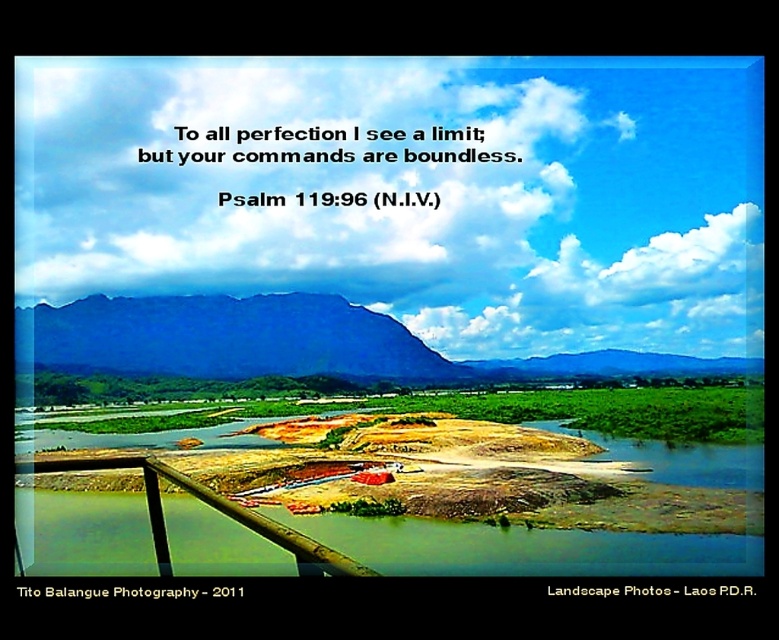
Is white fluffy cloud at upper center above brown dirt at lower center?

Yes.

Is white fluffy cloud at upper center to the left of brown dirt at lower center from the viewer's perspective?

Incorrect, white fluffy cloud at upper center is not on the left side of brown dirt at lower center.

What do you see at coordinates (409, 189) in the screenshot? The width and height of the screenshot is (779, 640). I see `white fluffy cloud at upper center` at bounding box center [409, 189].

This screenshot has width=779, height=640. In order to click on white fluffy cloud at upper center in this screenshot , I will do click(x=409, y=189).

Between point (326, 369) and point (333, 576), which one is positioned behind?

Point (326, 369)

Which of these two, blue rock mountain at center or brown wooden rail at lower left, stands taller?

blue rock mountain at center

Who is more forward, (x=407, y=349) or (x=83, y=464)?

Positioned in front is point (x=83, y=464).

This screenshot has height=640, width=779. Find the location of `blue rock mountain at center`. blue rock mountain at center is located at coordinates (226, 339).

Based on the photo, can you confirm if blue rock mountain at center is taller than brown dirt at lower center?

Indeed, blue rock mountain at center has a greater height compared to brown dirt at lower center.

Between blue rock mountain at center and brown dirt at lower center, which one appears on the right side from the viewer's perspective?

brown dirt at lower center is more to the right.

Is point (180, 362) closer to camera compared to point (382, 538)?

No, it is behind (382, 538).

The width and height of the screenshot is (779, 640). I want to click on blue rock mountain at center, so click(226, 339).